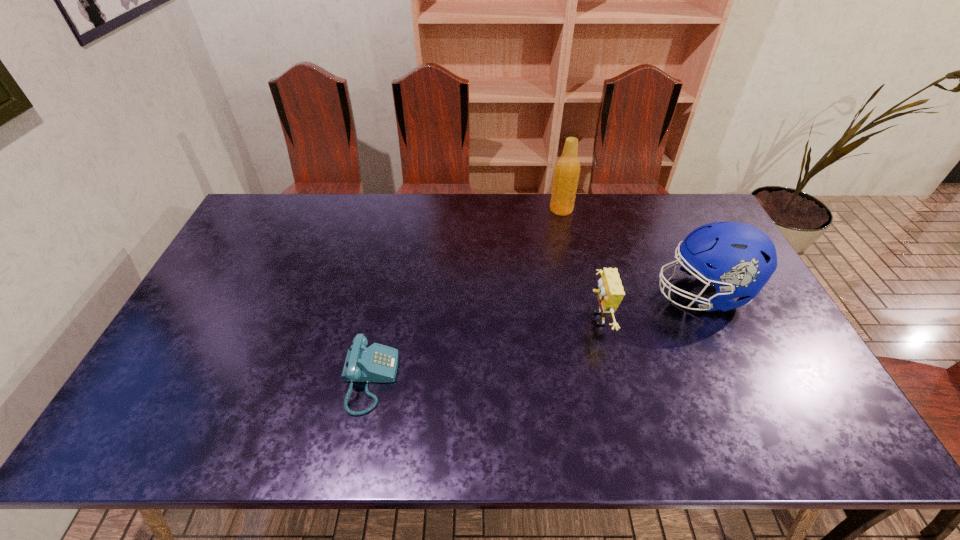
Locate which object ranks third in proximity to the beer bottle. Please provide its 2D coordinates. Your answer should be formatted as a tuple, i.e. [(x, y)], where the tuple contains the x and y coordinates of a point satisfying the conditions above.

[(378, 363)]